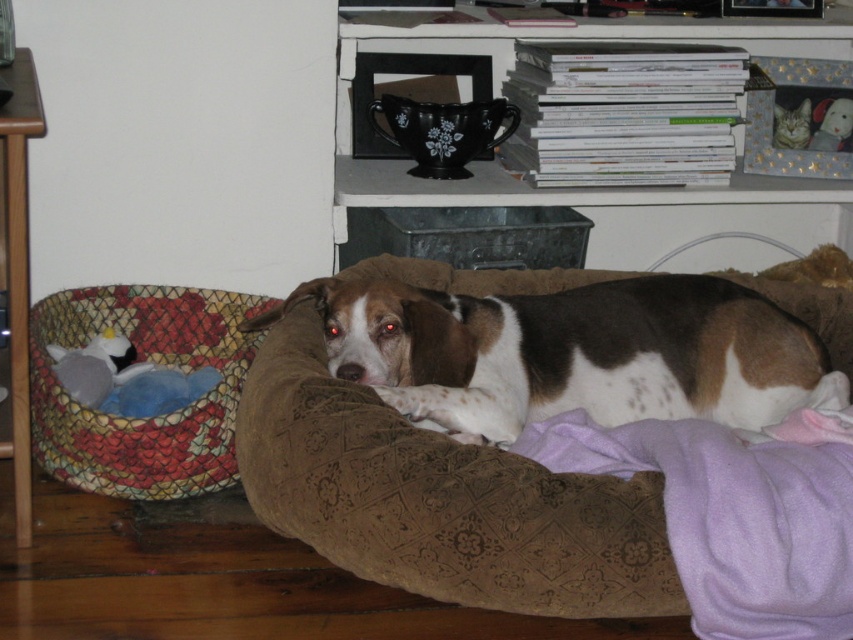
Is point (325, 417) farther from viewer compared to point (665, 360)?

No, (325, 417) is closer to viewer.

Who is more distant from viewer, [828,321] or [387,371]?

The point [828,321] is behind.

Locate an element on the screen. The height and width of the screenshot is (640, 853). brown velvety dog bed at center is located at coordinates (439, 499).

Can you confirm if brown velvety dog bed at center is wider than black ceramic mug at upper center?

No.

Does brown velvety dog bed at center come in front of black ceramic mug at upper center?

Yes, it is in front of black ceramic mug at upper center.

You are a GUI agent. You are given a task and a screenshot of the screen. Output one action in this format:
    pyautogui.click(x=<x>, y=<y>)
    Task: Click on the brown velvety dog bed at center
    The height and width of the screenshot is (640, 853).
    Given the screenshot: What is the action you would take?
    pyautogui.click(x=439, y=499)

I want to click on brown velvety dog bed at center, so click(x=439, y=499).

Does brown and white fur at center have a larger size compared to multicolored woven basket at left?

Correct, brown and white fur at center is larger in size than multicolored woven basket at left.

What do you see at coordinates (572, 353) in the screenshot? This screenshot has height=640, width=853. I see `brown and white fur at center` at bounding box center [572, 353].

Locate an element on the screen. Image resolution: width=853 pixels, height=640 pixels. brown and white fur at center is located at coordinates (572, 353).